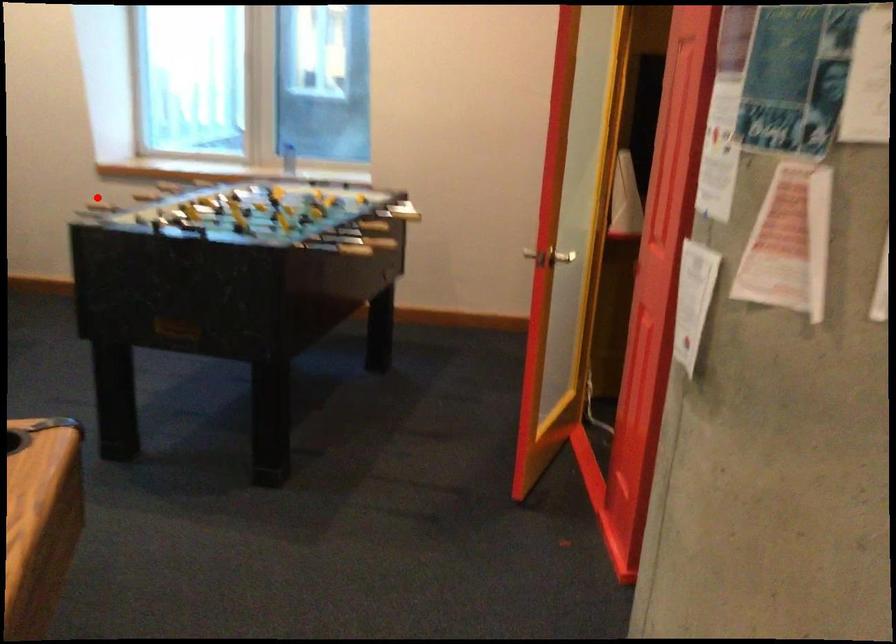
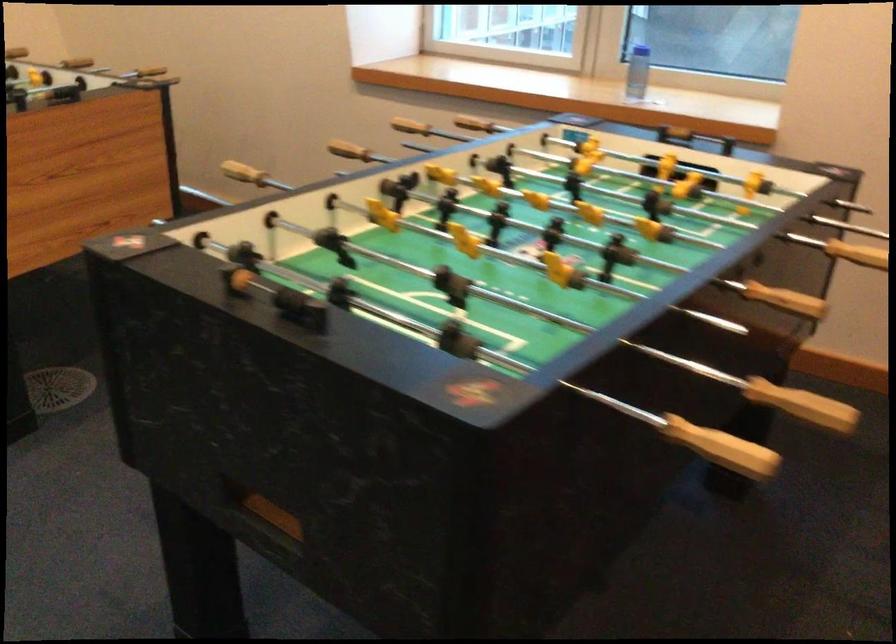
Question: A red point is marked in image1. In image2, is the corresponding 3D point closer to the camera or farther? Reply with the corresponding letter.

Choices:
 (A) The corresponding 3D point is closer.
 (B) The corresponding 3D point is farther.

Answer: (A)